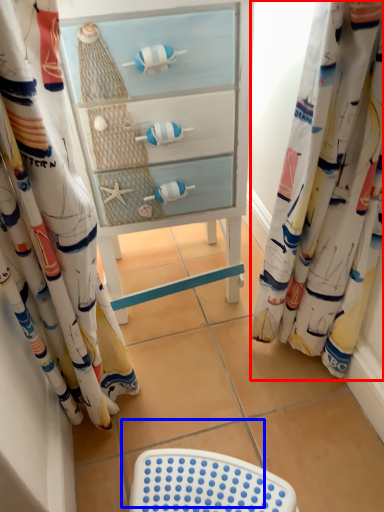
Question: Which object appears farthest to the camera in this image, curtain (highlighted by a red box) or tile (highlighted by a blue box)?

Choices:
 (A) curtain
 (B) tile

Answer: (B)